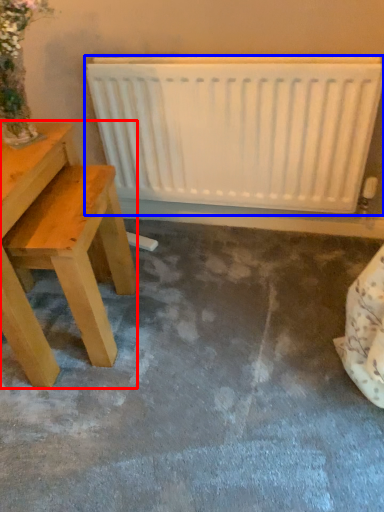
Question: Which point is further to the camera, table (highlighted by a red box) or radiator (highlighted by a blue box)?

Choices:
 (A) table
 (B) radiator

Answer: (B)